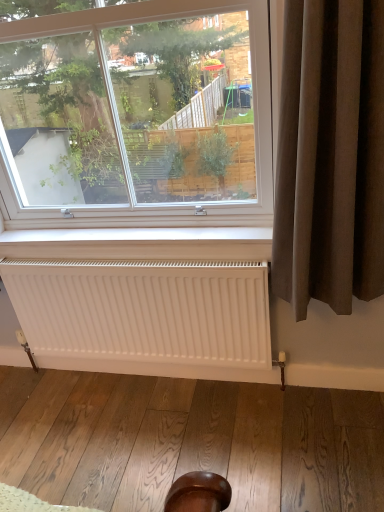
Identify the location of vacant space underneath brown fabric curtain at right (from a real-world perspective). Image resolution: width=384 pixels, height=512 pixels. (314, 408).